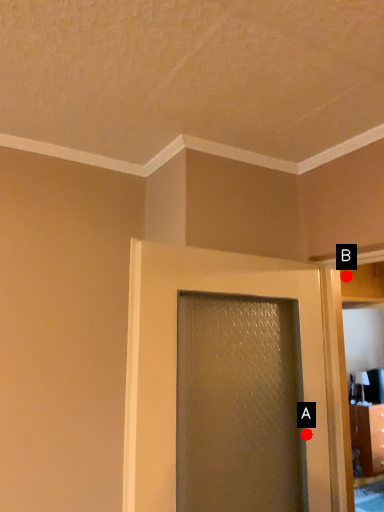
Question: Two points are circled on the image, labeled by A and B beside each circle. Which point is farther to the camera?

Choices:
 (A) A is further
 (B) B is further

Answer: (B)